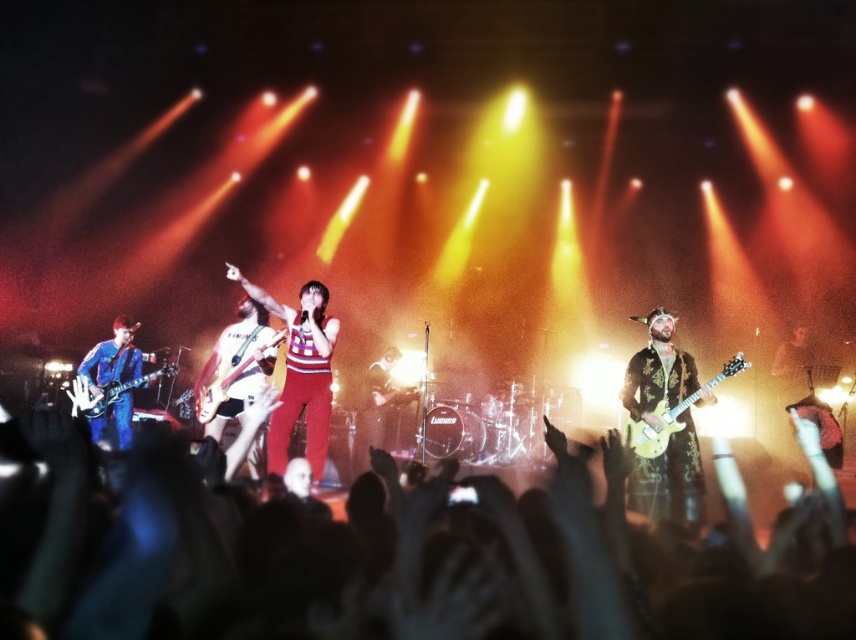
Is point (635, 570) positioned before point (203, 412)?

Yes.

Find the location of a particular element. silky black hair at center is located at coordinates (373, 563).

Image resolution: width=856 pixels, height=640 pixels. Identify the location of silky black hair at center. click(373, 563).

Who is more distant from viewer, (257, 294) or (638, 436)?

The point (257, 294) is behind.

Is shiny red pants at center closer to the viewer compared to shiny gold electric guitar at right?

No, it is not.

This screenshot has width=856, height=640. What are the coordinates of `shiny red pants at center` in the screenshot? It's located at (300, 372).

This screenshot has height=640, width=856. What do you see at coordinates (300, 372) in the screenshot? I see `shiny red pants at center` at bounding box center [300, 372].

What are the coordinates of `shiny red pants at center` in the screenshot? It's located at (300, 372).